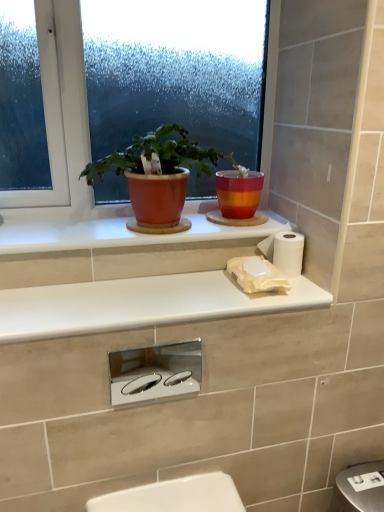
Question: Can you confirm if white glossy countertop at upper center, marked as the 2th window sill in a top-to-bottom arrangement, is positioned to the right of matte glass window at upper center?

Choices:
 (A) no
 (B) yes

Answer: (B)

Question: Considering the relative sizes of white glossy countertop at upper center, marked as the 2th window sill in a top-to-bottom arrangement, and matte glass window at upper center in the image provided, is white glossy countertop at upper center, marked as the 2th window sill in a top-to-bottom arrangement, thinner than matte glass window at upper center?

Choices:
 (A) no
 (B) yes

Answer: (A)

Question: Is white glossy countertop at upper center, which is the first window sill in bottom-to-top order, bigger than matte glass window at upper center?

Choices:
 (A) no
 (B) yes

Answer: (A)

Question: Can you confirm if white glossy countertop at upper center, which is the first window sill in bottom-to-top order, is shorter than matte glass window at upper center?

Choices:
 (A) yes
 (B) no

Answer: (A)

Question: Does white glossy countertop at upper center, marked as the 2th window sill in a top-to-bottom arrangement, come behind matte glass window at upper center?

Choices:
 (A) no
 (B) yes

Answer: (A)

Question: Relative to white glossy countertop at upper center, marked as the 2th window sill in a top-to-bottom arrangement, is matte glass window at upper center in front or behind?

Choices:
 (A) behind
 (B) front

Answer: (A)

Question: Considering the relative positions of matte glass window at upper center and white glossy countertop at upper center, which is the first window sill in bottom-to-top order, in the image provided, is matte glass window at upper center to the left or to the right of white glossy countertop at upper center, which is the first window sill in bottom-to-top order,?

Choices:
 (A) right
 (B) left

Answer: (B)

Question: From a real-world perspective, is matte glass window at upper center physically located above or below white glossy countertop at upper center, which is the first window sill in bottom-to-top order?

Choices:
 (A) below
 (B) above

Answer: (B)

Question: Would you say matte glass window at upper center is inside or outside white glossy countertop at upper center, which is the first window sill in bottom-to-top order?

Choices:
 (A) inside
 (B) outside

Answer: (B)

Question: From the image's perspective, is white ceramic window sill at upper center, the first window sill when ordered from top to bottom, positioned above or below white glossy countertop at upper center, which is the first window sill in bottom-to-top order?

Choices:
 (A) below
 (B) above

Answer: (B)

Question: In the image, is white ceramic window sill at upper center, the first window sill when ordered from top to bottom, positioned in front of or behind white glossy countertop at upper center, which is the first window sill in bottom-to-top order?

Choices:
 (A) front
 (B) behind

Answer: (B)

Question: Do you think white ceramic window sill at upper center, the first window sill when ordered from top to bottom, is within white glossy countertop at upper center, which is the first window sill in bottom-to-top order, or outside of it?

Choices:
 (A) outside
 (B) inside

Answer: (A)

Question: Considering the positions of point (99, 247) and point (33, 309), is point (99, 247) closer or farther from the camera than point (33, 309)?

Choices:
 (A) closer
 (B) farther

Answer: (B)

Question: Is white glossy countertop at upper center, which is the first window sill in bottom-to-top order, taller or shorter than matte orange pot at upper center?

Choices:
 (A) tall
 (B) short

Answer: (B)

Question: From a real-world perspective, is white glossy countertop at upper center, which is the first window sill in bottom-to-top order, above or below matte orange pot at upper center?

Choices:
 (A) above
 (B) below

Answer: (B)